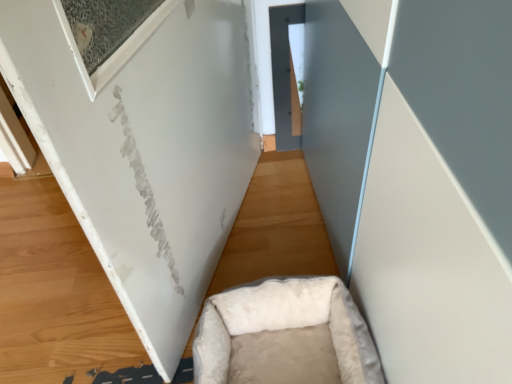
Locate an element on the screen. This screenshot has width=512, height=384. unoccupied space behind white plush pet bed at lower center is located at coordinates (270, 250).